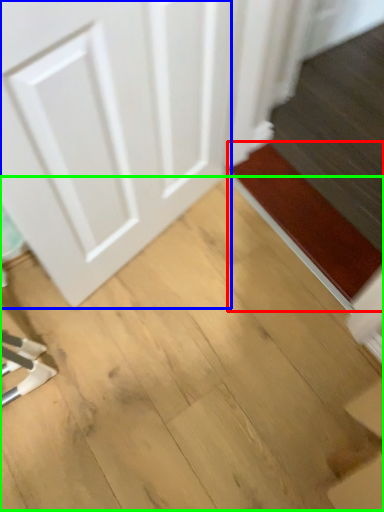
Question: Which object is the closest to the doormat (highlighted by a red box)? Choose among these: door (highlighted by a blue box) or plywood (highlighted by a green box).

Choices:
 (A) door
 (B) plywood

Answer: (B)